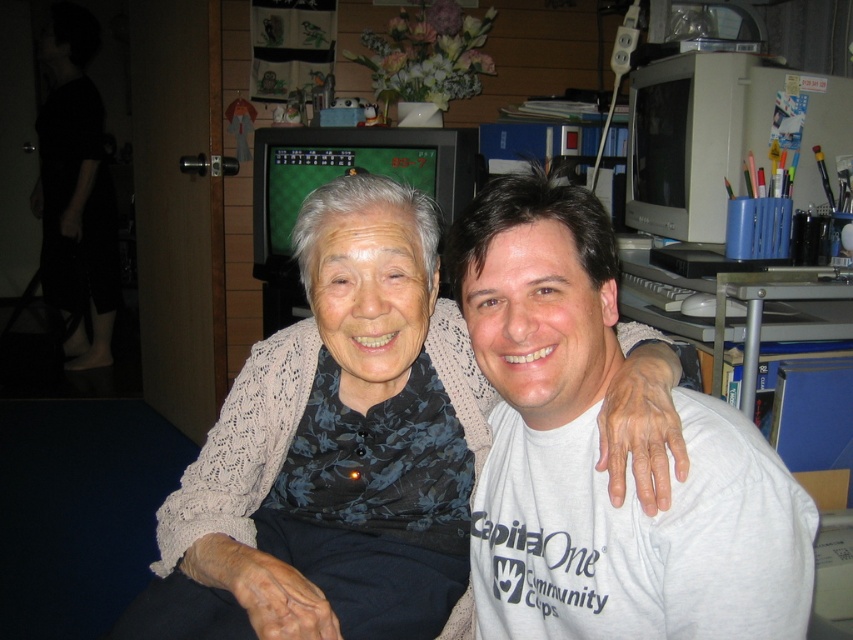
You are a photographer trying to focus on the knitted beige sweater at center and the dark blue fabric at lower left. Which object is nearer to the camera?

The knitted beige sweater at center is closer to the viewer than the dark blue fabric at lower left, so the knitted beige sweater at center will be in focus first.